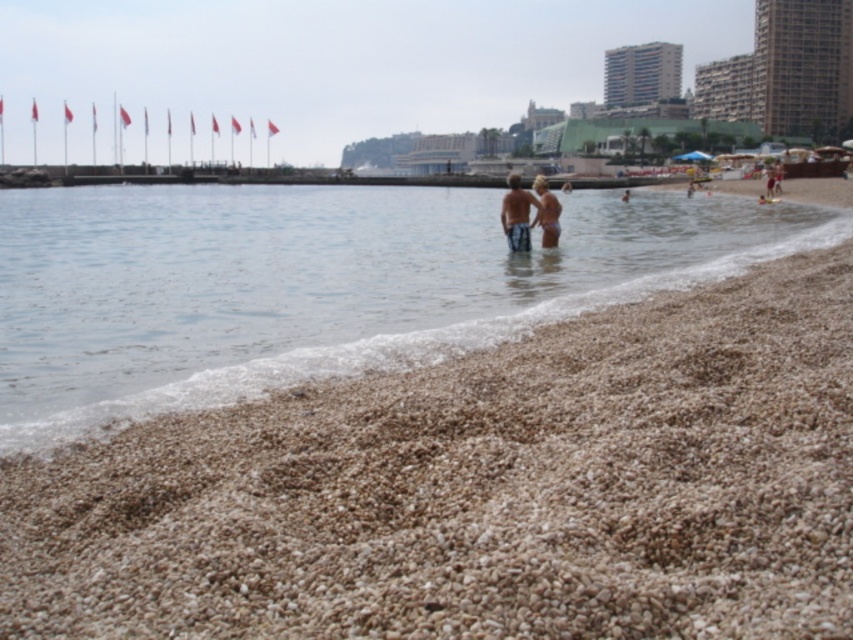
You are a photographer planning to capture a photo of the matte skin couple at center while ensuring the brown gravel at lower center is visible in the background. Given their sizes, will the couple appear larger than the gravel in the photo?

The brown gravel at lower center is smaller than the matte skin couple at center, so yes, the matte skin couple at center will appear larger than the brown gravel at lower center in the photo.